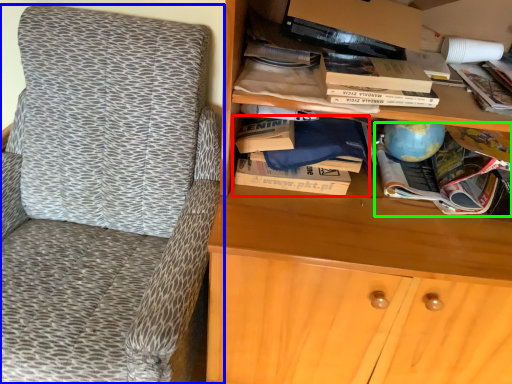
Question: Considering the real-world distances, which object is farthest from book (highlighted by a red box)? chair (highlighted by a blue box) or book (highlighted by a green box)?

Choices:
 (A) chair
 (B) book

Answer: (A)